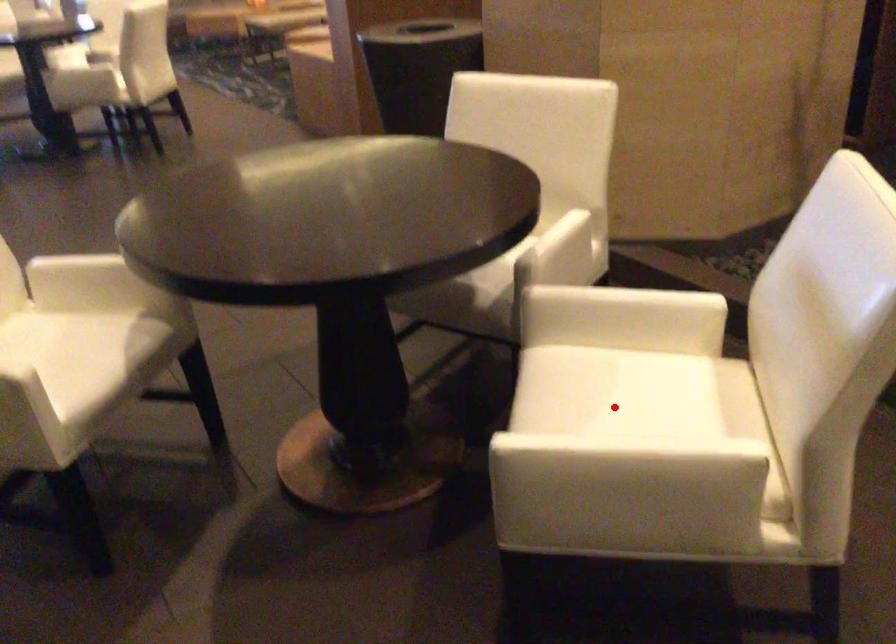
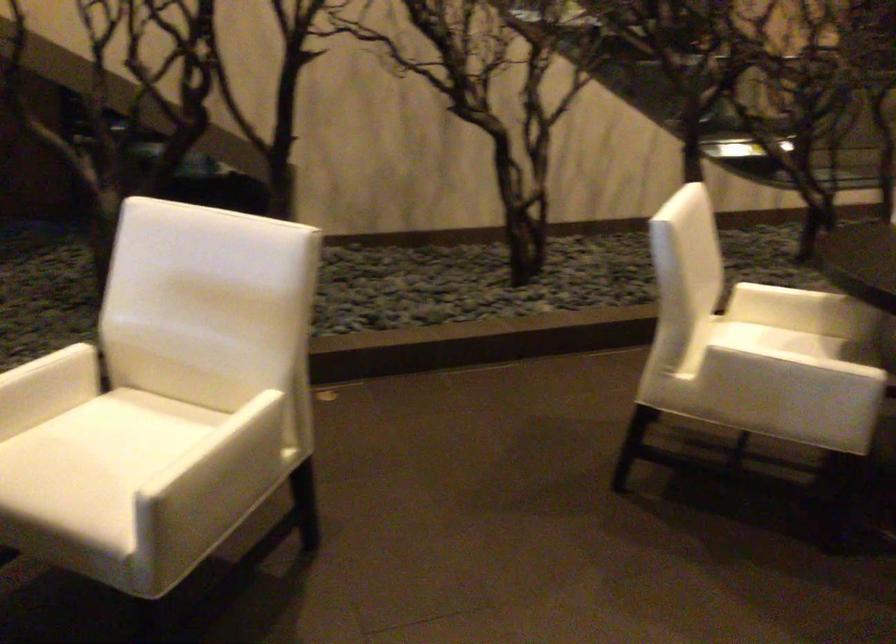
Where in the second image is the point corresponding to the highlighted location from the first image?

(105, 458)